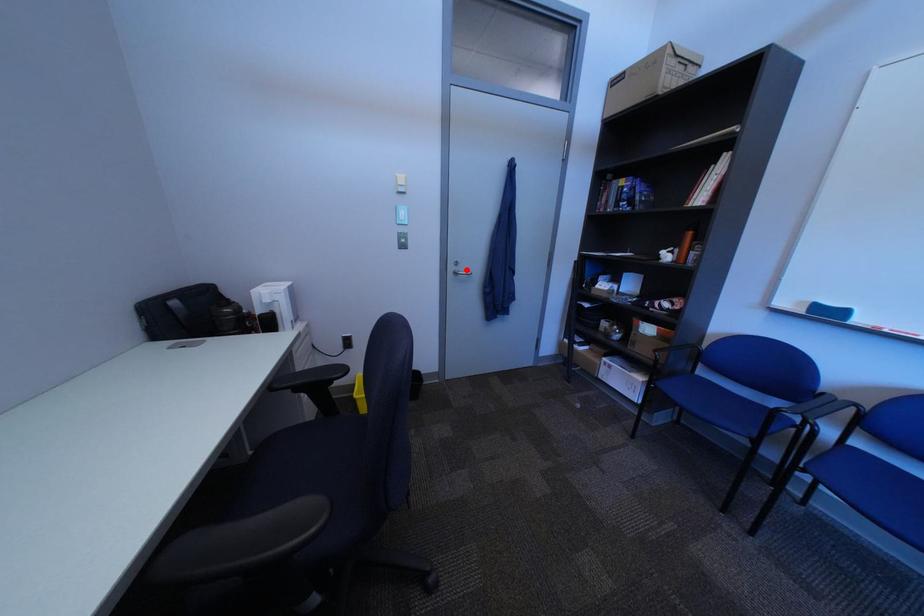
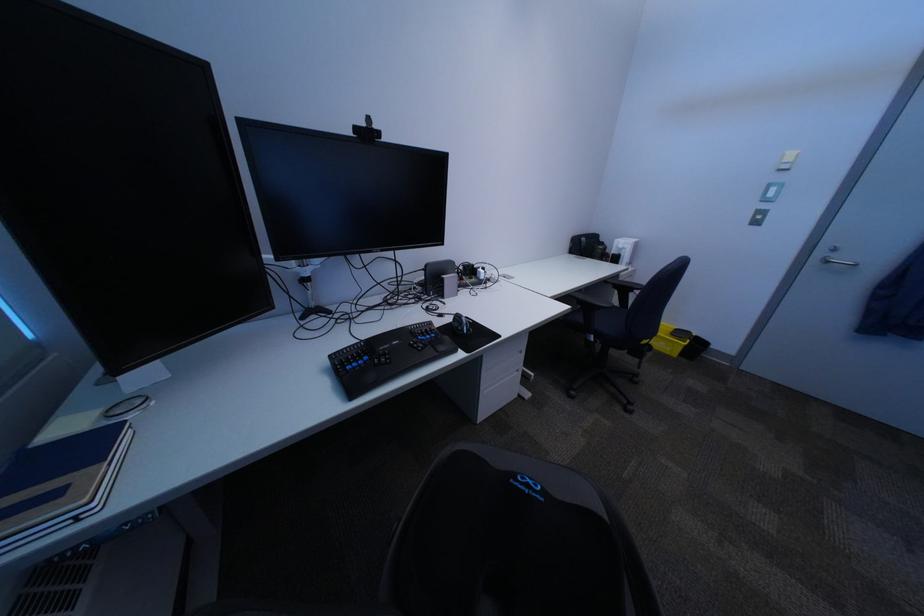
Locate, in the second image, the point that corresponds to the highlighted location in the first image.

(834, 254)